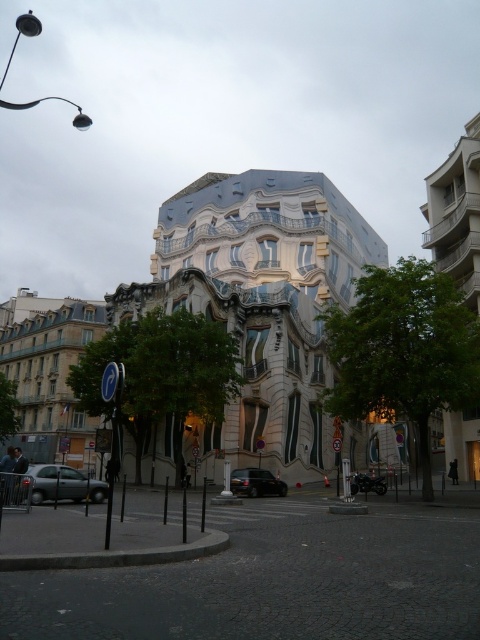
Between silver metallic car at lower left and shiny black car at center, which one appears on the right side from the viewer's perspective?

shiny black car at center is more to the right.

Does silver metallic car at lower left lie in front of shiny black car at center?

Yes, it is.

Is point (48, 496) closer to viewer compared to point (264, 472)?

Yes, point (48, 496) is closer to viewer.

This screenshot has width=480, height=640. Identify the location of silver metallic car at lower left. (62, 484).